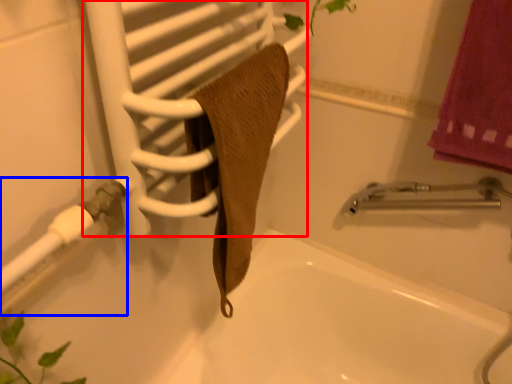
Question: Which point is further to the camera, screen door (highlighted by a red box) or shower (highlighted by a blue box)?

Choices:
 (A) screen door
 (B) shower

Answer: (B)